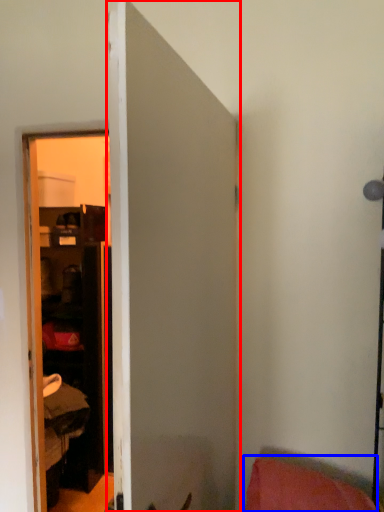
Question: Which object appears farthest to the camera in this image, door (highlighted by a red box) or pillow (highlighted by a blue box)?

Choices:
 (A) door
 (B) pillow

Answer: (B)